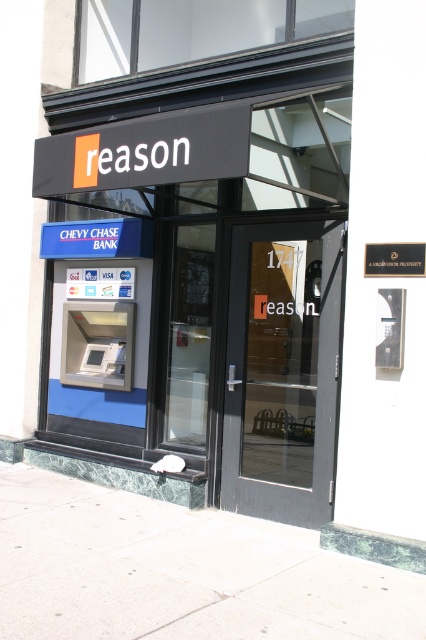
Question: Is gray concrete sidewalk at lower center to the left of matte glass door at center from the viewer's perspective?

Choices:
 (A) yes
 (B) no

Answer: (A)

Question: Among these objects, which one is farthest from the camera?

Choices:
 (A) matte glass door at center
 (B) metallic atm machine at center

Answer: (A)

Question: Which of these objects is positioned farthest from the metallic atm machine at center?

Choices:
 (A) gray concrete sidewalk at lower center
 (B) matte glass door at center

Answer: (A)

Question: Among these objects, which one is farthest from the camera?

Choices:
 (A) gray concrete sidewalk at lower center
 (B) metallic atm machine at center

Answer: (B)

Question: Is gray concrete sidewalk at lower center positioned behind matte glass door at center?

Choices:
 (A) yes
 (B) no

Answer: (B)

Question: Does metallic atm machine at center have a smaller size compared to matte glass door at center?

Choices:
 (A) no
 (B) yes

Answer: (A)